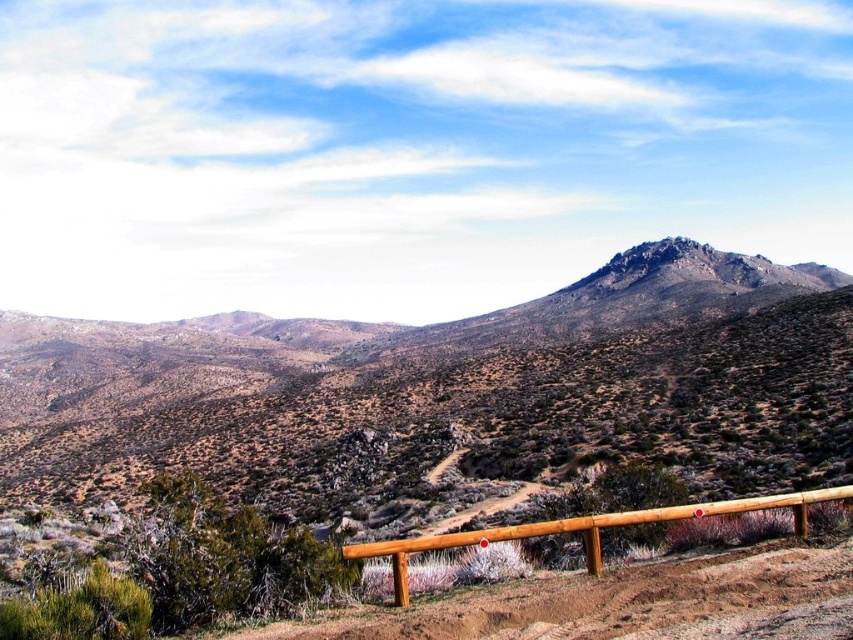
Where is `brown textured hill at center`? This screenshot has width=853, height=640. brown textured hill at center is located at coordinates (445, 396).

Does brown textured hill at center have a smaller size compared to brown dirt track at center?

Actually, brown textured hill at center might be larger than brown dirt track at center.

Does point (146, 353) lie in front of point (744, 596)?

That is False.

Identify the location of brown textured hill at center. (445, 396).

Can you confirm if brown dirt track at center is bigger than brown wooden rail at lower center?

Incorrect, brown dirt track at center is not larger than brown wooden rail at lower center.

Is point (711, 605) farther from viewer compared to point (850, 492)?

That is False.

You are a GUI agent. You are given a task and a screenshot of the screen. Output one action in this format:
    pyautogui.click(x=<x>, y=<y>)
    Task: Click on the brown dirt track at center
    The image size is (853, 640).
    Given the screenshot: What is the action you would take?
    pyautogui.click(x=624, y=604)

Can you confirm if brown textured hill at center is bigger than brown wooden rail at lower center?

Yes, brown textured hill at center is bigger than brown wooden rail at lower center.

Measure the distance between brown textured hill at center and camera.

A distance of 42.49 meters exists between brown textured hill at center and camera.

The height and width of the screenshot is (640, 853). In order to click on brown textured hill at center in this screenshot , I will do `click(445, 396)`.